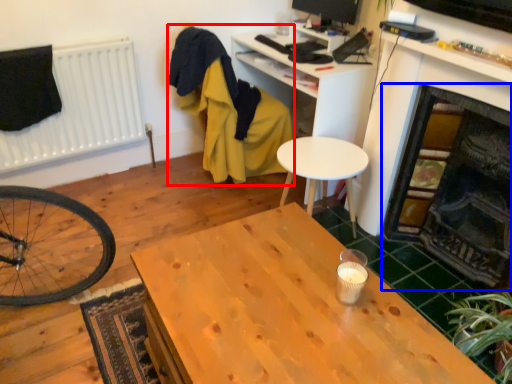
Question: Which object is closer to the camera taking this photo, swivel chair (highlighted by a red box) or fireplace (highlighted by a blue box)?

Choices:
 (A) swivel chair
 (B) fireplace

Answer: (B)